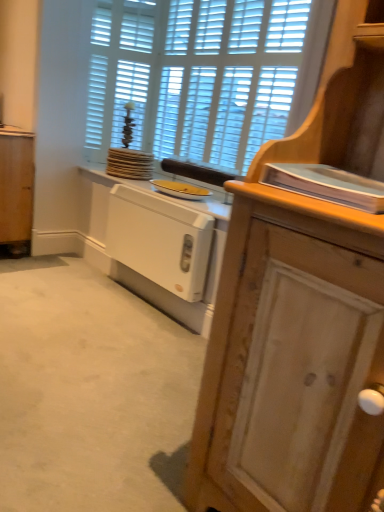
What is the approximate width of white plastic radiator at center?

white plastic radiator at center is 3.42 inches in width.

Identify the location of yellow matte plate at center. (180, 189).

The image size is (384, 512). What do you see at coordinates (300, 319) in the screenshot?
I see `wooden cabinet at right, the 1th cabinetry in the right-to-left sequence` at bounding box center [300, 319].

What is the approximate width of wooden cabinet at right, the 1th cabinetry in the right-to-left sequence?

The width of wooden cabinet at right, the 1th cabinetry in the right-to-left sequence, is 17.34 inches.

I want to click on white painted wood radiator at lower center, the 2th cabinetry viewed from the right, so click(x=152, y=246).

Does white painted wood radiator at lower center, which appears as the second cabinetry when viewed from the left, turn towards wooden cabinet at left, the third cabinetry viewed from the front?

No.

From a real-world perspective, is white painted wood radiator at lower center, placed as the second cabinetry when sorted from back to front, located beneath wooden cabinet at left, the first cabinetry viewed from the left?

Yes, from a real-world perspective, white painted wood radiator at lower center, placed as the second cabinetry when sorted from back to front, is under wooden cabinet at left, the first cabinetry viewed from the left.

Considering the relative sizes of white painted wood radiator at lower center, which is the second cabinetry from front to back, and wooden cabinet at left, arranged as the third cabinetry when viewed from the right, in the image provided, is white painted wood radiator at lower center, which is the second cabinetry from front to back, thinner than wooden cabinet at left, arranged as the third cabinetry when viewed from the right,?

Correct, the width of white painted wood radiator at lower center, which is the second cabinetry from front to back, is less than that of wooden cabinet at left, arranged as the third cabinetry when viewed from the right.

Is white painted wood radiator at lower center, the 2th cabinetry viewed from the right, far away from wooden cabinet at left, the third cabinetry viewed from the front?

No, there isn't a large distance between white painted wood radiator at lower center, the 2th cabinetry viewed from the right, and wooden cabinet at left, the third cabinetry viewed from the front.

Does wooden cabinet at left, arranged as the third cabinetry when viewed from the right, have a greater width compared to wooden cabinet at right, the first cabinetry positioned from the front?

No.

Could you tell me if wooden cabinet at left, the third cabinetry viewed from the front, is facing wooden cabinet at right, the first cabinetry positioned from the front?

No.

In the image, is wooden cabinet at left, the 1th cabinetry when ordered from back to front, positioned in front of or behind wooden cabinet at right, the first cabinetry positioned from the front?

wooden cabinet at left, the 1th cabinetry when ordered from back to front, is positioned farther from the viewer than wooden cabinet at right, the first cabinetry positioned from the front.

Could you tell me if wooden cabinet at right, the 1th cabinetry in the right-to-left sequence, is turned towards yellow matte plate at center?

No, wooden cabinet at right, the 1th cabinetry in the right-to-left sequence, is not oriented towards yellow matte plate at center.

What's the angular difference between wooden cabinet at right, the third cabinetry when ordered from back to front, and yellow matte plate at center's facing directions?

There is a 1.45-degree angle between the facing directions of wooden cabinet at right, the third cabinetry when ordered from back to front, and yellow matte plate at center.

Which of these two, wooden cabinet at right, the 3th cabinetry positioned from the left, or yellow matte plate at center, stands shorter?

yellow matte plate at center.

Is the position of wooden cabinet at right, the first cabinetry positioned from the front, less distant than that of yellow matte plate at center?

Yes.

Considering the points (207, 195) and (83, 262), which point is behind, point (207, 195) or point (83, 262)?

The point (83, 262) is behind.

Consider the image. Would you say yellow matte plate at center contains wooden cabinet at right?

No, wooden cabinet at right is not surrounded by yellow matte plate at center.

From a real-world perspective, is yellow matte plate at center located beneath wooden cabinet at right?

No, from a real-world perspective, yellow matte plate at center is not beneath wooden cabinet at right.

Is yellow matte plate at center at the right side of wooden cabinet at right?

Indeed, yellow matte plate at center is positioned on the right side of wooden cabinet at right.

From the image's perspective, which object appears higher, yellow matte plate at center or white plastic radiator at center?

yellow matte plate at center.

Would you say yellow matte plate at center is to the left or to the right of white plastic radiator at center in the picture?

In the image, yellow matte plate at center appears on the right side of white plastic radiator at center.

Is yellow matte plate at center turned away from white plastic radiator at center?

No.

Is wooden cabinet at right smaller than yellow matte plate at center?

No, wooden cabinet at right is not smaller than yellow matte plate at center.

Considering the sizes of wooden cabinet at right and yellow matte plate at center in the image, is wooden cabinet at right taller or shorter than yellow matte plate at center?

In the image, wooden cabinet at right appears to be taller than yellow matte plate at center.

From the image's perspective, relative to yellow matte plate at center, is wooden cabinet at right above or below?

wooden cabinet at right is situated lower than yellow matte plate at center in the image.

From the picture: Would you say wooden cabinet at right is outside yellow matte plate at center?

Indeed, wooden cabinet at right is completely outside yellow matte plate at center.

Considering the relative sizes of wooden cabinet at right, the third cabinetry when ordered from back to front, and white wooden shutters at upper center in the image provided, is wooden cabinet at right, the third cabinetry when ordered from back to front, shorter than white wooden shutters at upper center?

In fact, wooden cabinet at right, the third cabinetry when ordered from back to front, may be taller than white wooden shutters at upper center.

Considering the positions of point (366, 328) and point (102, 42), is point (366, 328) closer or farther from the camera than point (102, 42)?

Point (366, 328) is closer to the camera than point (102, 42).

Is the surface of wooden cabinet at right, the 3th cabinetry positioned from the left, in direct contact with white wooden shutters at upper center?

No, wooden cabinet at right, the 3th cabinetry positioned from the left, is not in contact with white wooden shutters at upper center.

Where is `cabinetry directly beneath the wooden cabinet at left, the first cabinetry viewed from the left (from a real-world perspective)`? cabinetry directly beneath the wooden cabinet at left, the first cabinetry viewed from the left (from a real-world perspective) is located at coordinates (152, 246).

The width and height of the screenshot is (384, 512). There is a wooden cabinet at left, the 1th cabinetry when ordered from back to front. Identify the location of cabinetry above it (from a real-world perspective). (300, 319).

When comparing their distances from wooden cabinet at left, the third cabinetry viewed from the front, does yellow matte plate at center or white painted wood radiator at lower center, which is the second cabinetry from front to back, seem further?

yellow matte plate at center lies further to wooden cabinet at left, the third cabinetry viewed from the front, than the other object.

From the image, which object appears to be nearer to white wooden shutters at upper center, yellow matte plate at center or wooden cabinet at left, the 1th cabinetry when ordered from back to front?

The object closer to white wooden shutters at upper center is yellow matte plate at center.

Estimate the real-world distances between objects in this image. Which object is closer to white painted wood radiator at lower center, the 2th cabinetry viewed from the right, wooden cabinet at right or yellow matte plate at center?

yellow matte plate at center.

When comparing their distances from wooden cabinet at right, does yellow matte plate at center or wooden cabinet at right, the first cabinetry positioned from the front, seem further?

yellow matte plate at center lies further to wooden cabinet at right than the other object.

When comparing their distances from yellow matte plate at center, does white painted wood radiator at lower center, which appears as the second cabinetry when viewed from the left, or wooden cabinet at right seem closer?

white painted wood radiator at lower center, which appears as the second cabinetry when viewed from the left, is closer to yellow matte plate at center.

Looking at the image, which one is located further to white painted wood radiator at lower center, placed as the second cabinetry when sorted from back to front, wooden cabinet at right, the first cabinetry positioned from the front, or yellow matte plate at center?

The object further to white painted wood radiator at lower center, placed as the second cabinetry when sorted from back to front, is wooden cabinet at right, the first cabinetry positioned from the front.

From the image, which object appears to be nearer to wooden cabinet at right, the third cabinetry when ordered from back to front, wooden cabinet at right or wooden cabinet at left, the third cabinetry viewed from the front?

Based on the image, wooden cabinet at right appears to be nearer to wooden cabinet at right, the third cabinetry when ordered from back to front.

Based on their spatial positions, is yellow matte plate at center or wooden cabinet at right, the 3th cabinetry positioned from the left, further from white painted wood radiator at lower center, which is the second cabinetry from front to back?

wooden cabinet at right, the 3th cabinetry positioned from the left, is positioned further to the anchor white painted wood radiator at lower center, which is the second cabinetry from front to back.

What are the coordinates of `home appliance located between wooden cabinet at right, the third cabinetry when ordered from back to front, and white wooden shutters at upper center in the depth direction` in the screenshot? It's located at (160, 240).

The image size is (384, 512). I want to click on plain located between wooden cabinet at right, the 1th cabinetry in the right-to-left sequence, and wooden cabinet at left, the 1th cabinetry when ordered from back to front, in the depth direction, so click(x=90, y=393).

This screenshot has height=512, width=384. What are the coordinates of `plain positioned between wooden cabinet at right, the first cabinetry positioned from the front, and yellow matte plate at center from near to far` in the screenshot? It's located at (90, 393).

Find the location of a particular element. home appliance located between wooden cabinet at right and white painted wood radiator at lower center, which is the second cabinetry from front to back, in the depth direction is located at coordinates (160, 240).